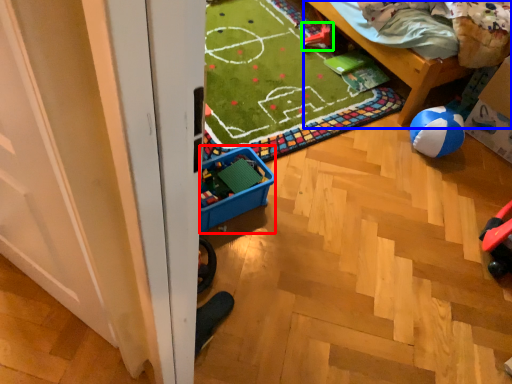
Question: Which is farther away from storage box (highlighted by a red box)? furniture (highlighted by a blue box) or toy (highlighted by a green box)?

Choices:
 (A) furniture
 (B) toy

Answer: (B)